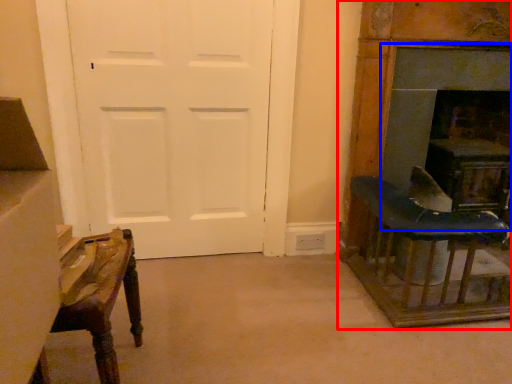
Question: Among these objects, which one is nearest to the camera, furniture (highlighted by a red box) or fireplace (highlighted by a blue box)?

Choices:
 (A) furniture
 (B) fireplace

Answer: (A)